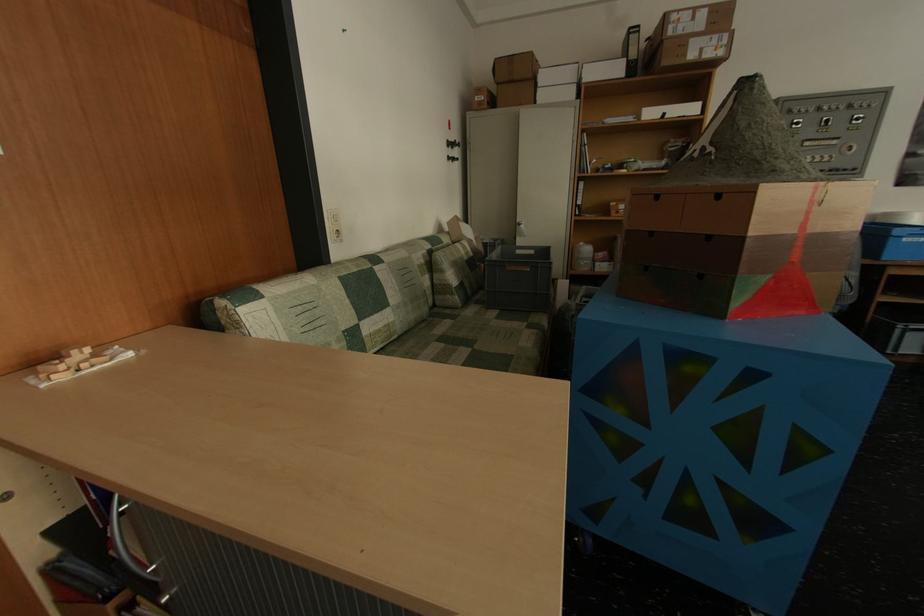
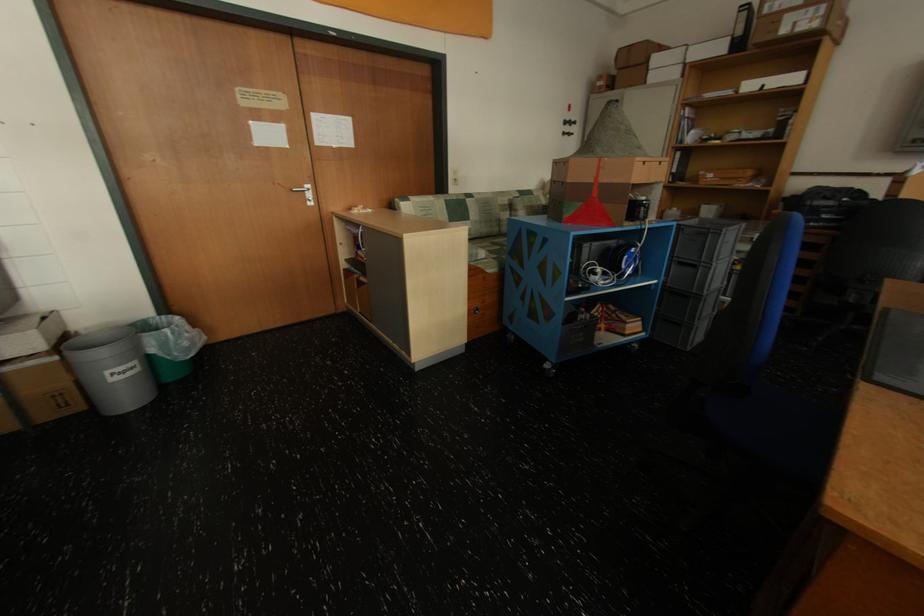
Where in the second image is the point corresponding to (384,270) from the first image?

(476, 201)